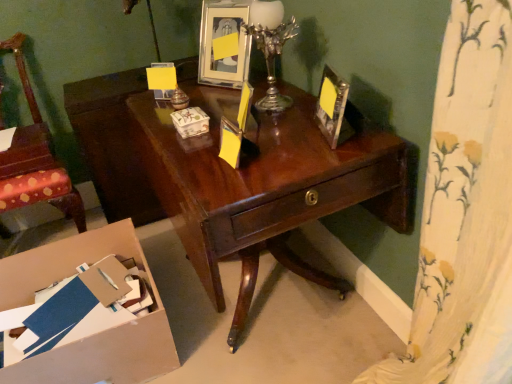
Image resolution: width=512 pixels, height=384 pixels. What are the coordinates of `free space behind matte ceramic box at center` in the screenshot? It's located at (199, 108).